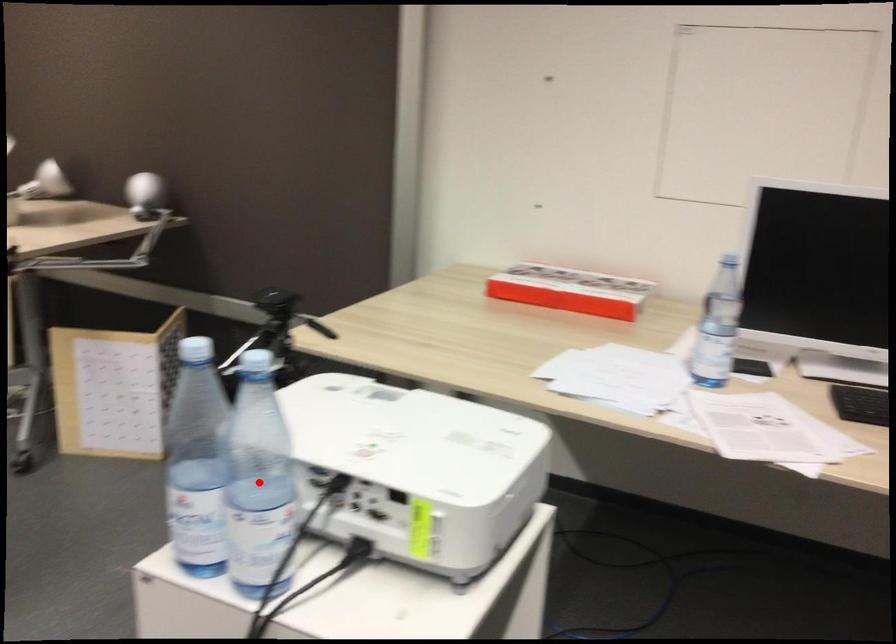
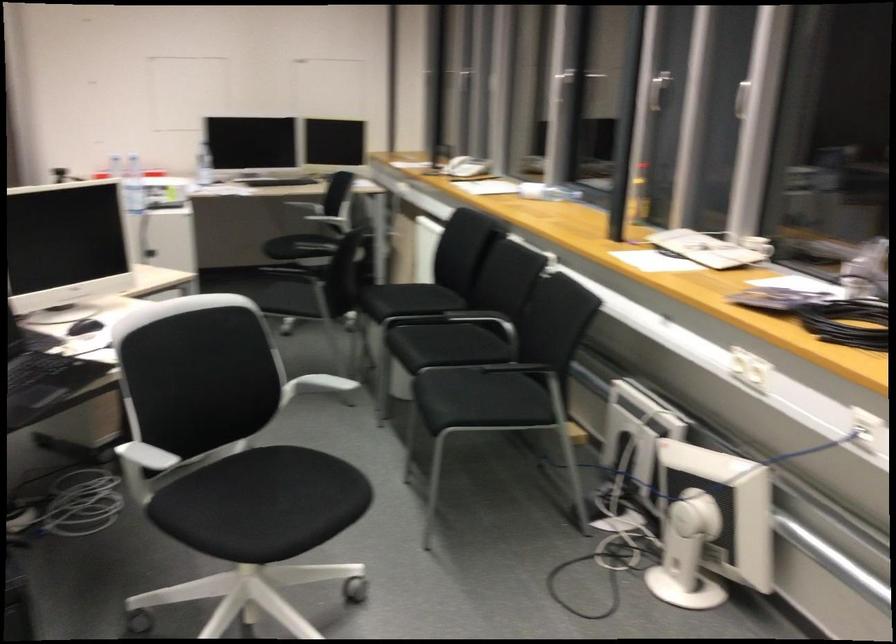
Question: I am providing you with two images of the same scene from different viewpoints. A red point is marked on the first image. Is the red point's position out of view in image 2?

Choices:
 (A) Yes
 (B) No

Answer: (A)